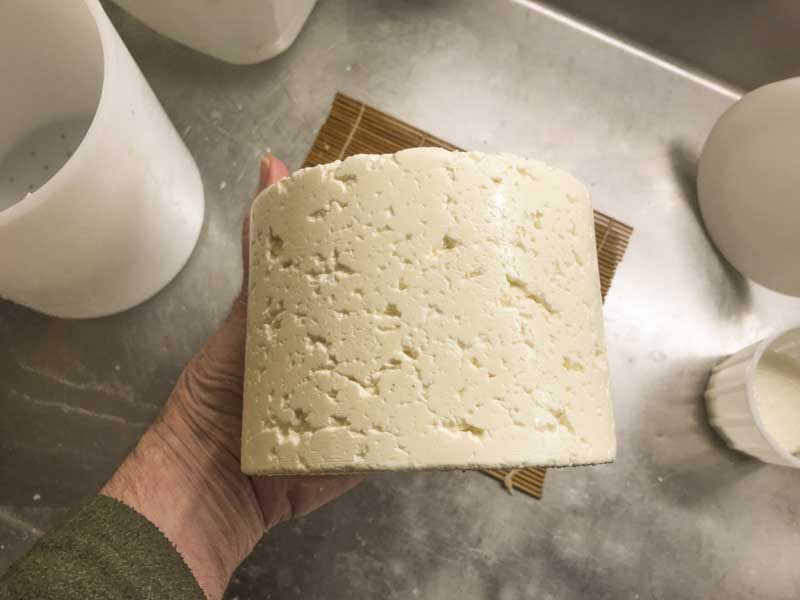
The height and width of the screenshot is (600, 800). Find the location of `area off table`. area off table is located at coordinates (701, 37).